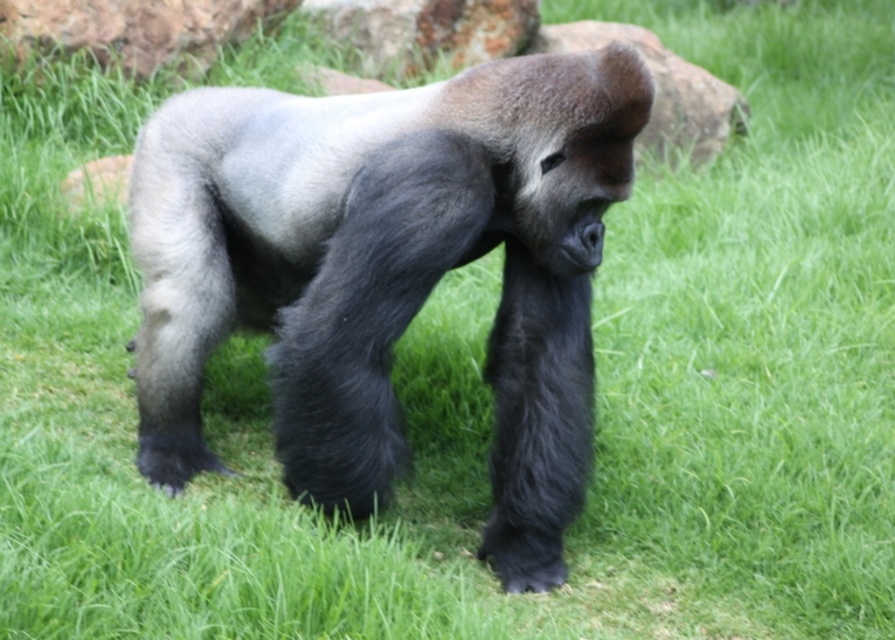
You are a zookeeper observing the gorilla in its enclosure. You notice a specific point marked at coordinates (386, 272). Where is the fuzzy gray gorilla at center relative to this point?

The fuzzy gray gorilla at center is located exactly at the point marked at coordinates (386, 272).

You are a photographer trying to capture the fuzzy gray gorilla at center in your shot. The brown rough rock at upper center is blocking part of the gorilla. How can you adjust your position to ensure the gorilla is fully visible without the rock obstructing it?

Since the fuzzy gray gorilla at center is in front of the brown rough rock at upper center, you can move your camera position slightly lower or to the side to avoid the rock blocking the view of the gorilla.

You are a small animal trying to hide from the gorilla. The rusty metal rock at upper center and the green grass at lower left are both potential hiding spots. Which hiding spot is taller and would provide better cover?

The rusty metal rock at upper center is taller than the green grass at lower left, so it would provide better cover for hiding from the gorilla.